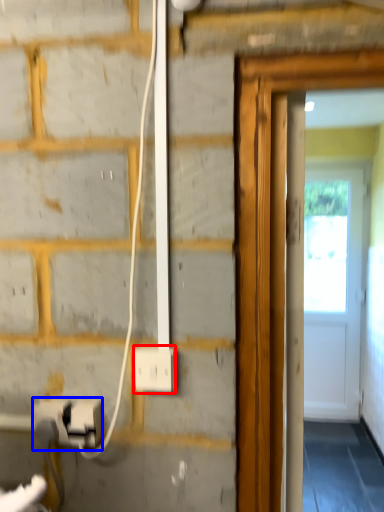
Question: Which object appears farthest to the camera in this image, power plugs and sockets (highlighted by a red box) or electric outlet (highlighted by a blue box)?

Choices:
 (A) power plugs and sockets
 (B) electric outlet

Answer: (B)